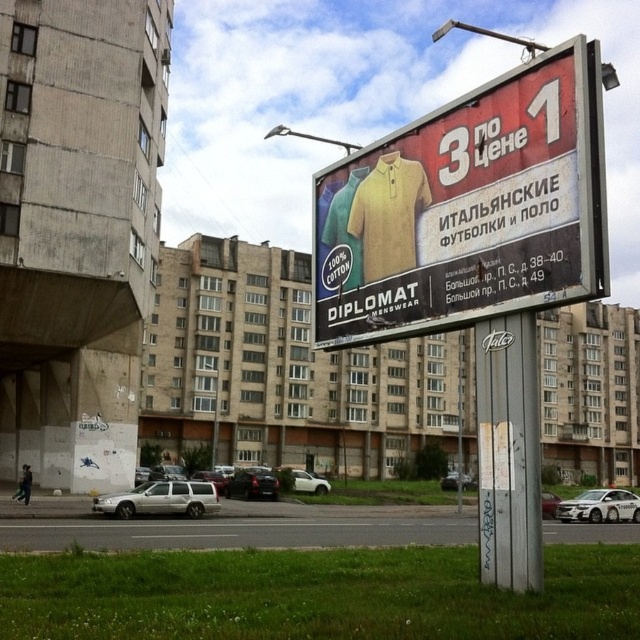
Who is more distant from viewer, (472, 180) or (321, 481)?

The point (321, 481) is behind.

In the scene shown: Does red matte signboard at upper right appear over white matte car at lower center?

Indeed, red matte signboard at upper right is positioned over white matte car at lower center.

Identify the location of red matte signboard at upper right. (467, 209).

This screenshot has width=640, height=640. I want to click on red matte signboard at upper right, so click(x=467, y=209).

Which of these two, red matte signboard at upper right or silver metallic suv at lower left, stands shorter?

Standing shorter between the two is silver metallic suv at lower left.

Does point (333, 195) lie in front of point (164, 500)?

Yes, it is in front of point (164, 500).

In order to click on red matte signboard at upper right in this screenshot , I will do `click(467, 209)`.

Which is above, shiny black sedan at center or white matte car at lower center?

Positioned higher is white matte car at lower center.

Is point (268, 484) positioned after point (307, 476)?

That is False.

Is point (262, 483) positioned before point (321, 483)?

Yes, it is in front of point (321, 483).

Image resolution: width=640 pixels, height=640 pixels. I want to click on shiny black sedan at center, so point(252,484).